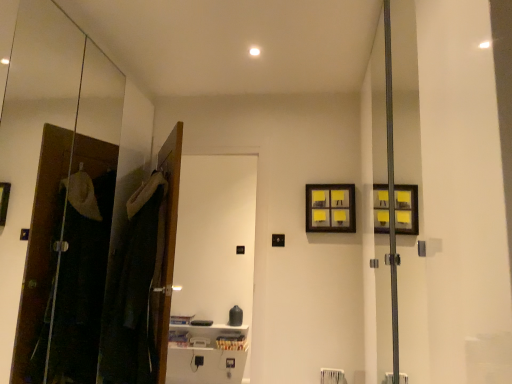
What do you see at coordinates (330, 208) in the screenshot?
I see `yellow paper at upper right` at bounding box center [330, 208].

Locate an element on the screen. The height and width of the screenshot is (384, 512). yellow paper at upper right is located at coordinates (330, 208).

Describe the element at coordinates (135, 290) in the screenshot. I see `dark fabric laundry at left` at that location.

I want to click on yellow paper at upper right, so click(x=330, y=208).

Can you confirm if white glossy screen door at center is thinner than dark fabric laundry at left?

Indeed, white glossy screen door at center has a lesser width compared to dark fabric laundry at left.

Is white glossy screen door at center with dark fabric laundry at left?

white glossy screen door at center and dark fabric laundry at left are clearly separated.

Between point (225, 273) and point (111, 355), which one is positioned behind?

Positioned behind is point (225, 273).

How many degrees apart are the facing directions of dark fabric laundry at left and yellow paper at upper right?

They differ by 25.9 degrees in their facing directions.

You are a GUI agent. You are given a task and a screenshot of the screen. Output one action in this format:
    pyautogui.click(x=<x>, y=<y>)
    Task: Click on the laundry that appears below the yellow paper at upper right (from the image's perspective)
    
    Given the screenshot: What is the action you would take?
    pyautogui.click(x=135, y=290)

Which is more to the left, dark fabric laundry at left or yellow paper at upper right?

From the viewer's perspective, dark fabric laundry at left appears more on the left side.

From the image's perspective, is dark fabric laundry at left above yellow paper at upper right?

No, from the image's perspective, dark fabric laundry at left is not above yellow paper at upper right.

Which point is more distant from viewer, (336, 190) or (148, 300)?

Point (336, 190)

Identify the location of laundry that is below the yellow paper at upper right (from the image's perspective). (135, 290).

From the picture: Considering the positions of objects yellow paper at upper right and dark fabric laundry at left in the image provided, who is more to the right, yellow paper at upper right or dark fabric laundry at left?

yellow paper at upper right.

From the image's perspective, which one is positioned lower, dark fabric laundry at left or white glossy screen door at center?

From the image's view, white glossy screen door at center is below.

Is point (153, 381) behind point (188, 351)?

No.

Which of these two, dark fabric laundry at left or white glossy screen door at center, is thinner?

white glossy screen door at center.

Is white glossy screen door at center surrounded by dark fabric laundry at left?

That's incorrect, white glossy screen door at center is not inside dark fabric laundry at left.

Considering the sizes of objects yellow paper at upper right and white glossy screen door at center in the image provided, who is shorter, yellow paper at upper right or white glossy screen door at center?

Standing shorter between the two is yellow paper at upper right.

From a real-world perspective, relative to white glossy screen door at center, is yellow paper at upper right vertically above or below?

Clearly, from a real-world perspective, yellow paper at upper right is above white glossy screen door at center.

Is yellow paper at upper right positioned far away from white glossy screen door at center?

yellow paper at upper right is positioned a significant distance from white glossy screen door at center.

Would you say yellow paper at upper right contains white glossy screen door at center?

No, white glossy screen door at center is located outside of yellow paper at upper right.

Considering the relative sizes of white glossy screen door at center and yellow paper at upper right in the image provided, is white glossy screen door at center thinner than yellow paper at upper right?

No, white glossy screen door at center is not thinner than yellow paper at upper right.

From a real-world perspective, between white glossy screen door at center and yellow paper at upper right, who is vertically lower?

white glossy screen door at center.

Does white glossy screen door at center appear on the left side of yellow paper at upper right?

Yes, white glossy screen door at center is to the left of yellow paper at upper right.

Locate an element on the screen. This screenshot has height=384, width=512. screen door behind the dark fabric laundry at left is located at coordinates (213, 265).

Locate an element on the screen. picture frame on the right of dark fabric laundry at left is located at coordinates (330, 208).

From the image, which object appears to be nearer to white glossy screen door at center, dark fabric laundry at left or yellow paper at upper right?

The object closer to white glossy screen door at center is yellow paper at upper right.

Consider the image. Looking at the image, which one is located closer to dark fabric laundry at left, white glossy screen door at center or yellow paper at upper right?

yellow paper at upper right is closer to dark fabric laundry at left.

From the image, which object appears to be farther from yellow paper at upper right, white glossy screen door at center or dark fabric laundry at left?

white glossy screen door at center is positioned further to the anchor yellow paper at upper right.

When comparing their distances from yellow paper at upper right, does dark fabric laundry at left or white glossy screen door at center seem closer?

dark fabric laundry at left lies closer to yellow paper at upper right than the other object.

When comparing their distances from white glossy screen door at center, does yellow paper at upper right or dark fabric laundry at left seem closer?

yellow paper at upper right is closer to white glossy screen door at center.

Based on the photo, when comparing their distances from dark fabric laundry at left, does yellow paper at upper right or white glossy screen door at center seem further?

Among the two, white glossy screen door at center is located further to dark fabric laundry at left.

At what (x,y) coordinates should I click in order to perform the action: click on screen door situated between dark fabric laundry at left and yellow paper at upper right from left to right. Please return your answer as a coordinate pair (x, y). Looking at the image, I should click on (213, 265).